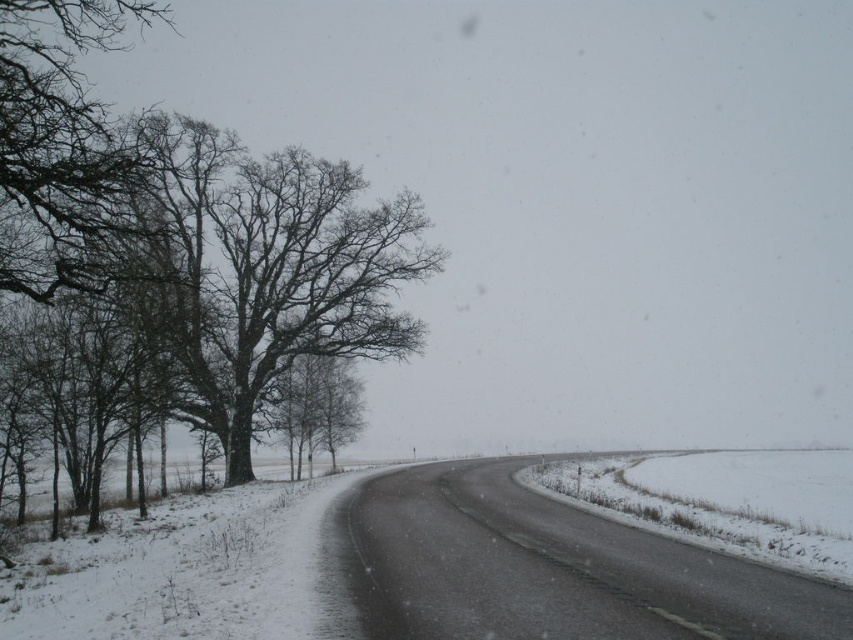
What do you see at coordinates (201, 304) in the screenshot? I see `dark brown bark tree at left` at bounding box center [201, 304].

Is dark brown bark tree at left behind bare branches at left?

Yes, dark brown bark tree at left is behind bare branches at left.

Identify the location of dark brown bark tree at left. (201, 304).